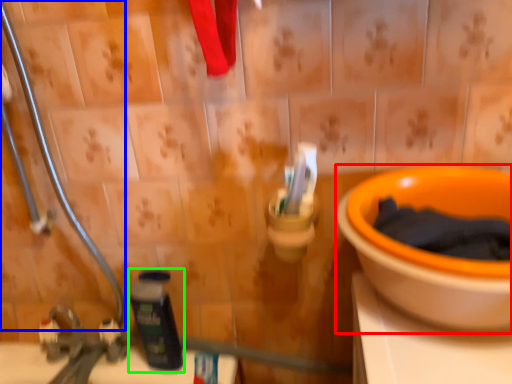
Question: Which object is the farthest from toilet (highlighted by a red box)? Choose among these: pipe (highlighted by a blue box) or bottle (highlighted by a green box).

Choices:
 (A) pipe
 (B) bottle

Answer: (A)